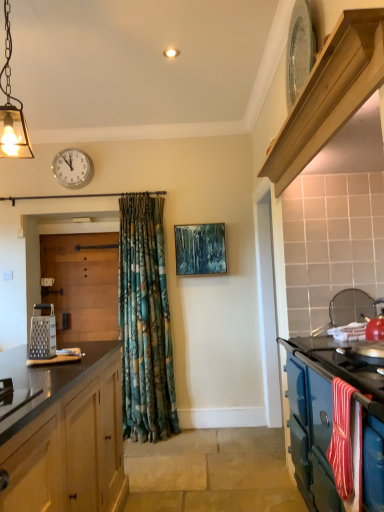
Measure the distance between point (x=325, y=360) and camera.

1.94 meters.

Identify the location of wooden door at left. Image resolution: width=384 pixels, height=512 pixels. (82, 284).

Describe the element at coordinates (82, 284) in the screenshot. I see `wooden door at left` at that location.

What are the coordinates of `white glossy clock at upper center` in the screenshot? It's located at (72, 168).

At what (x,y) coordinates should I click in order to perform the action: click on blue enamel stove at right. Please return your answer as a coordinate pair (x, y). Looking at the image, I should click on (334, 425).

From the image's perspective, relative to textured blue painting at center, is blue enamel stove at right above or below?

From the image's perspective, blue enamel stove at right appears below textured blue painting at center.

Is point (318, 419) farther from camera compared to point (206, 236)?

No, (318, 419) is in front of (206, 236).

Is textured blue painting at center a part of blue enamel stove at right?

Actually, textured blue painting at center is outside blue enamel stove at right.

From a real-world perspective, does blue enamel stove at right sit lower than textured blue painting at center?

Yes, from a real-world perspective, blue enamel stove at right is below textured blue painting at center.

How many degrees apart are the facing directions of metallic grater at left and white glossy clock at upper center?

The facing directions of metallic grater at left and white glossy clock at upper center are 89.8 degrees apart.

Can you confirm if metallic grater at left is bigger than white glossy clock at upper center?

Actually, metallic grater at left might be smaller than white glossy clock at upper center.

Considering the positions of points (45, 303) and (88, 177), is point (45, 303) farther from camera compared to point (88, 177)?

Yes, it is.

From a real-world perspective, which is physically below, metallic grater at left or white glossy clock at upper center?

From a 3D spatial view, metallic grater at left is below.

Identify the location of cabinetry below the light wood/texture shelf at upper right (from the image's perspective). This screenshot has height=512, width=384. (334, 425).

Considering the sizes of objects light wood/texture shelf at upper right and blue enamel stove at right in the image provided, who is bigger, light wood/texture shelf at upper right or blue enamel stove at right?

blue enamel stove at right is bigger.

From a real-world perspective, is light wood/texture shelf at upper right physically located above or below blue enamel stove at right?

From a real-world perspective, light wood/texture shelf at upper right is physically above blue enamel stove at right.

From the image's perspective, is light wood/texture shelf at upper right positioned above or below blue enamel stove at right?

light wood/texture shelf at upper right is above blue enamel stove at right.

Would you say textured blue painting at center is to the left or to the right of white glossy clock at upper center in the picture?

From the image, it's evident that textured blue painting at center is to the right of white glossy clock at upper center.

Is textured blue painting at center in contact with white glossy clock at upper center?

textured blue painting at center is not next to white glossy clock at upper center, and they're not touching.

From the image's perspective, which object appears higher, textured blue painting at center or white glossy clock at upper center?

white glossy clock at upper center, from the image's perspective.

You are a GUI agent. You are given a task and a screenshot of the screen. Output one action in this format:
    pyautogui.click(x=<x>, y=<y>)
    Task: Click on the picture frame below the white glossy clock at upper center (from the image's perspective)
    The image size is (384, 512).
    Given the screenshot: What is the action you would take?
    pyautogui.click(x=200, y=249)

Relative to textured blue painting at center, is white glossy clock at upper center in front or behind?

Visually, white glossy clock at upper center is located behind textured blue painting at center.

Is there a large distance between white glossy clock at upper center and textured blue painting at center?

Absolutely, white glossy clock at upper center is distant from textured blue painting at center.

In terms of width, does matte glass pendant light at upper left look wider or thinner when compared to metallic grater at left?

Considering their sizes, matte glass pendant light at upper left looks broader than metallic grater at left.

Is matte glass pendant light at upper left not within metallic grater at left?

Yes, matte glass pendant light at upper left is located beyond the bounds of metallic grater at left.

Is matte glass pendant light at upper left turned away from metallic grater at left?

No, metallic grater at left is not at the back of matte glass pendant light at upper left.

Between matte glass pendant light at upper left and metallic grater at left, which one is positioned behind?

Positioned behind is metallic grater at left.

In the scene shown: Is light wood/texture shelf at upper right taller or shorter than metallic grater at left?

light wood/texture shelf at upper right is shorter than metallic grater at left.

Looking at this image, from the image's perspective, which object appears higher, light wood/texture shelf at upper right or metallic grater at left?

light wood/texture shelf at upper right.

Is light wood/texture shelf at upper right far away from metallic grater at left?

light wood/texture shelf at upper right is far away from metallic grater at left.

Which object is thinner, light wood/texture shelf at upper right or metallic grater at left?

metallic grater at left.

Locate an element on the screen. The image size is (384, 512). picture frame on the left of blue enamel stove at right is located at coordinates (200, 249).

You are a GUI agent. You are given a task and a screenshot of the screen. Output one action in this format:
    pyautogui.click(x=<x>, y=<y>)
    Task: Click on the clock above the metallic grater at left (from a real-world perspective)
    
    Given the screenshot: What is the action you would take?
    pyautogui.click(x=72, y=168)

Estimate the real-world distances between objects in this image. Which object is closer to matte glass pendant light at upper left, light wood/texture shelf at upper right or wooden door at left?

light wood/texture shelf at upper right is closer to matte glass pendant light at upper left.

Considering their positions, is wooden door at left positioned closer to white glossy clock at upper center than textured blue painting at center?

wooden door at left.

From the picture: From the image, which object appears to be nearer to matte glass pendant light at upper left, metallic grater at left or blue enamel stove at right?

metallic grater at left is closer to matte glass pendant light at upper left.

When comparing their distances from textured blue painting at center, does wooden door at left or light wood/texture shelf at upper right seem closer?

wooden door at left is closer to textured blue painting at center.

Which object lies further to the anchor point blue enamel stove at right, textured blue painting at center or wooden door at left?

The object further to blue enamel stove at right is wooden door at left.

Considering their positions, is blue enamel stove at right positioned closer to matte glass pendant light at upper left than wooden door at left?

blue enamel stove at right lies closer to matte glass pendant light at upper left than the other object.

Looking at the image, which one is located closer to matte glass pendant light at upper left, wooden door at left or light wood/texture shelf at upper right?

light wood/texture shelf at upper right lies closer to matte glass pendant light at upper left than the other object.

Based on their spatial positions, is white glossy clock at upper center or textured blue painting at center further from blue enamel stove at right?

Based on the image, white glossy clock at upper center appears to be further to blue enamel stove at right.

Locate an element on the screen. This screenshot has height=512, width=384. light fixture between blue enamel stove at right and textured blue painting at center from front to back is located at coordinates (12, 109).

Where is `door between white glossy clock at upper center and textured blue painting at center in the horizontal direction`? This screenshot has height=512, width=384. door between white glossy clock at upper center and textured blue painting at center in the horizontal direction is located at coordinates (82, 284).

Locate an element on the screen. The width and height of the screenshot is (384, 512). clock between blue enamel stove at right and wooden door at left along the z-axis is located at coordinates (72, 168).

The height and width of the screenshot is (512, 384). I want to click on appliance between light wood/texture shelf at upper right and textured blue painting at center along the z-axis, so click(42, 333).